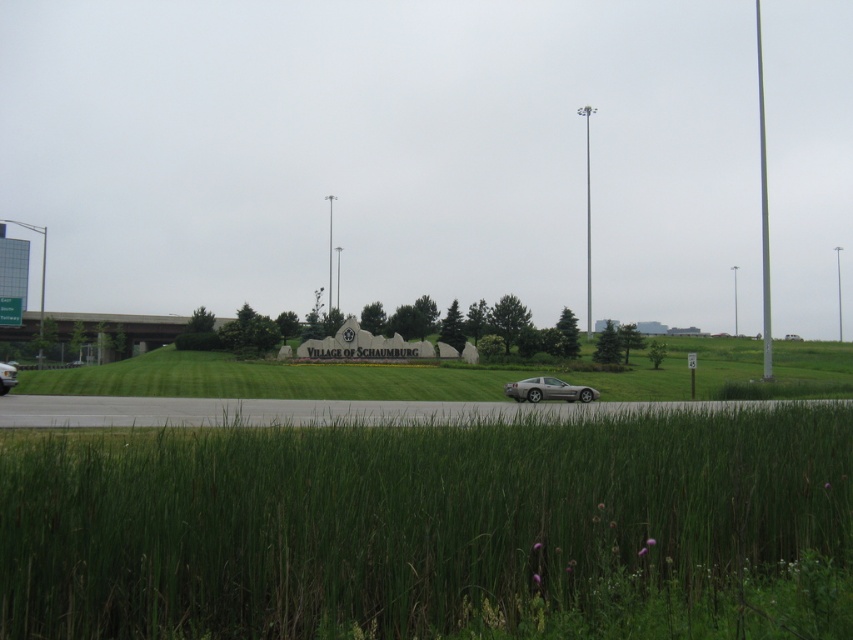
You are a drone operator trying to land a drone on a flat surface. You have two options in the image provided. Which area would you choose between the green grass at lower center and the silver metallic car at lower left, and why?

You should choose the green grass at lower center because it occupies less space than the silver metallic car at lower left, making it a safer and more stable landing area for the drone.

You are standing at the point marked by the coordinates point (422, 524). Looking around, what do you see immediately below you?

The point (422, 524) indicates green grass at lower center, so you are standing on green grass at lower center.